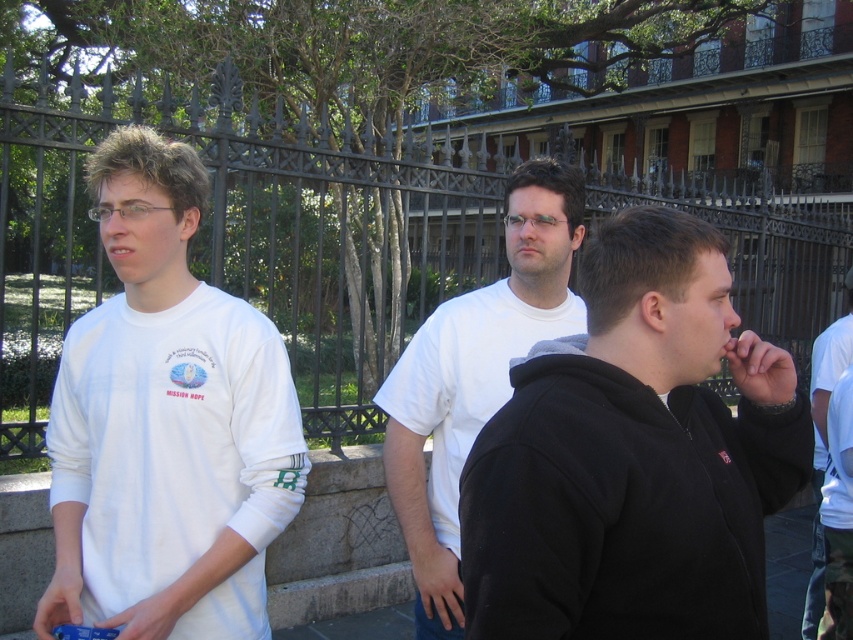
Question: Is black fleece jacket at center bigger than white cotton t-shirt at center?

Choices:
 (A) no
 (B) yes

Answer: (A)

Question: Which of the following is the farthest from the observer?

Choices:
 (A) (424, 630)
 (B) (100, 460)
 (C) (747, 529)

Answer: (A)

Question: Is white cotton t-shirt at center smaller than white t-shirt at center?

Choices:
 (A) yes
 (B) no

Answer: (A)

Question: Considering the real-world distances, which object is closest to the white matte long-sleeve shirt at left?

Choices:
 (A) white cotton t-shirt at center
 (B) black fleece jacket at center

Answer: (A)

Question: Is white cotton t-shirt at center below white t-shirt at center?

Choices:
 (A) no
 (B) yes

Answer: (A)

Question: Which point appears farthest from the camera in this image?

Choices:
 (A) (248, 468)
 (B) (482, 372)
 (C) (811, 360)

Answer: (C)